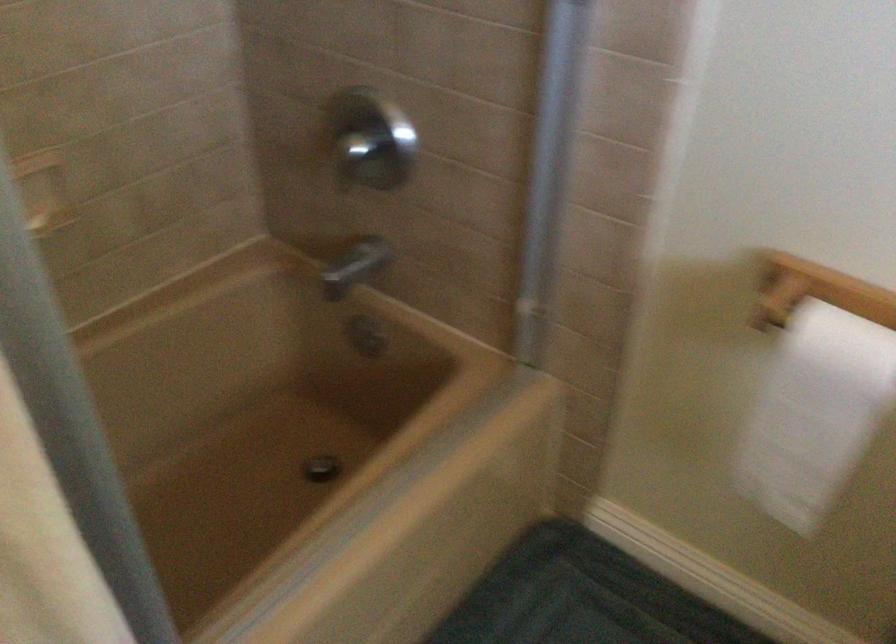
How did the camera likely rotate?

The camera's rotation is toward left-down.